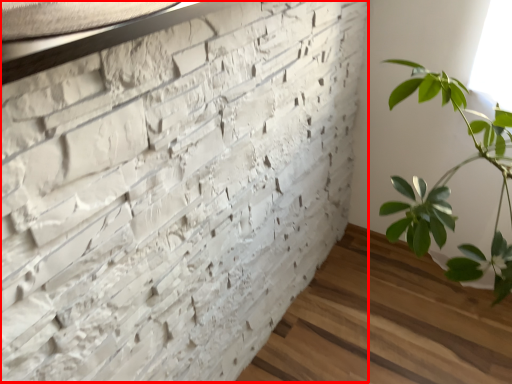
Question: Considering the relative positions of brickwork (annotated by the red box) and window sill in the image provided, where is brickwork (annotated by the red box) located with respect to the staircase?

Choices:
 (A) left
 (B) right

Answer: (B)